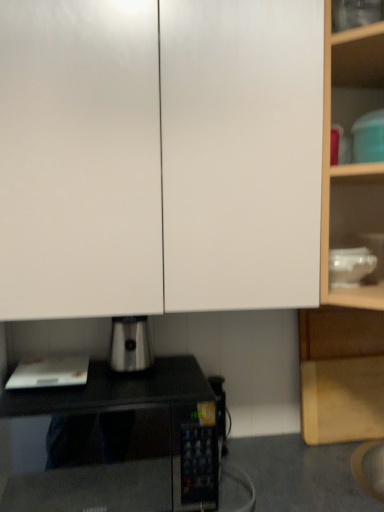
Question: Considering the relative positions of black matte microwave oven at center and teal plastic container at upper right, the first appliance viewed from the top, in the image provided, is black matte microwave oven at center in front of teal plastic container at upper right, the first appliance viewed from the top,?

Choices:
 (A) yes
 (B) no

Answer: (A)

Question: Could you tell me if black matte microwave oven at center is facing teal plastic container at upper right, which is the third appliance in bottom-to-top order?

Choices:
 (A) yes
 (B) no

Answer: (B)

Question: Does black matte microwave oven at center have a lesser height compared to teal plastic container at upper right, the first appliance viewed from the top?

Choices:
 (A) yes
 (B) no

Answer: (B)

Question: Does black matte microwave oven at center have a smaller size compared to teal plastic container at upper right, the first appliance viewed from the top?

Choices:
 (A) yes
 (B) no

Answer: (B)

Question: From a real-world perspective, is black matte microwave oven at center located higher than teal plastic container at upper right, positioned as the first appliance in right-to-left order?

Choices:
 (A) no
 (B) yes

Answer: (A)

Question: Is black matte microwave oven at center turned away from teal plastic container at upper right, the third appliance when ordered from left to right?

Choices:
 (A) no
 (B) yes

Answer: (A)

Question: Can you confirm if transparent glass bowl at upper right, which ranks as the 2th appliance in right-to-left order, is wider than black matte microwave oven at center?

Choices:
 (A) yes
 (B) no

Answer: (B)

Question: Considering the relative positions of transparent glass bowl at upper right, placed as the 2th appliance when sorted from left to right, and black matte microwave oven at center in the image provided, is transparent glass bowl at upper right, placed as the 2th appliance when sorted from left to right, to the right of black matte microwave oven at center from the viewer's perspective?

Choices:
 (A) no
 (B) yes

Answer: (B)

Question: From a real-world perspective, is transparent glass bowl at upper right, placed as the 2th appliance when sorted from bottom to top, on black matte microwave oven at center?

Choices:
 (A) yes
 (B) no

Answer: (A)

Question: Is transparent glass bowl at upper right, placed as the 2th appliance when sorted from left to right, oriented away from black matte microwave oven at center?

Choices:
 (A) yes
 (B) no

Answer: (B)

Question: Is transparent glass bowl at upper right, placed as the 2th appliance when sorted from bottom to top, located outside black matte microwave oven at center?

Choices:
 (A) yes
 (B) no

Answer: (A)

Question: Can you confirm if transparent glass bowl at upper right, arranged as the 2th appliance when viewed from the top, is thinner than black matte microwave oven at center?

Choices:
 (A) no
 (B) yes

Answer: (B)

Question: Is white glossy cabinet doors at upper center, which is counted as the second cabinetry, starting from the bottom, not near transparent glass bowl at upper right, placed as the 2th appliance when sorted from left to right?

Choices:
 (A) yes
 (B) no

Answer: (B)